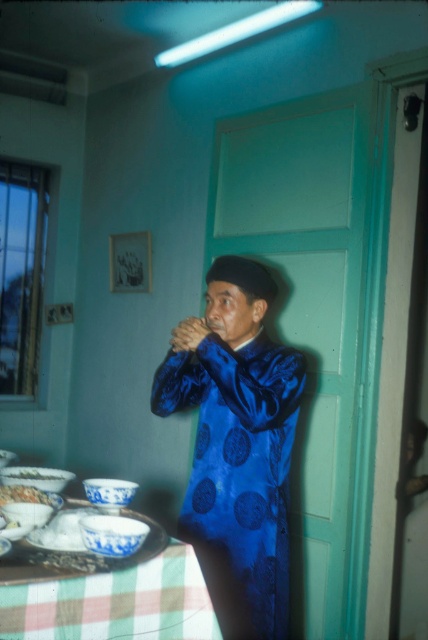
Question: Which point is closer to the camera?

Choices:
 (A) (229, 550)
 (B) (47, 500)

Answer: (B)

Question: Can you confirm if shiny blue robe at center is positioned to the left of white porcelain bowl at lower left?

Choices:
 (A) yes
 (B) no

Answer: (B)

Question: Which object is positioned farthest from the white glossy bowl at lower left?

Choices:
 (A) white porcelain bowl at lower left
 (B) checkered fabric tablecloth at lower left
 (C) shiny blue robe at center

Answer: (B)

Question: Which of the following is the closest to the observer?

Choices:
 (A) (20, 472)
 (B) (220, 534)
 (C) (127, 628)

Answer: (C)

Question: Is shiny blue robe at center above white porcelain bowl at lower left?

Choices:
 (A) yes
 (B) no

Answer: (A)

Question: Considering the relative positions of checkered fabric tablecloth at lower left and white glossy bowl at lower left in the image provided, where is checkered fabric tablecloth at lower left located with respect to white glossy bowl at lower left?

Choices:
 (A) below
 (B) above

Answer: (A)